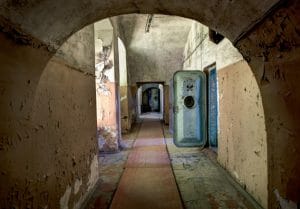
Identify the location of doorway. This screenshot has height=209, width=300. (213, 108).